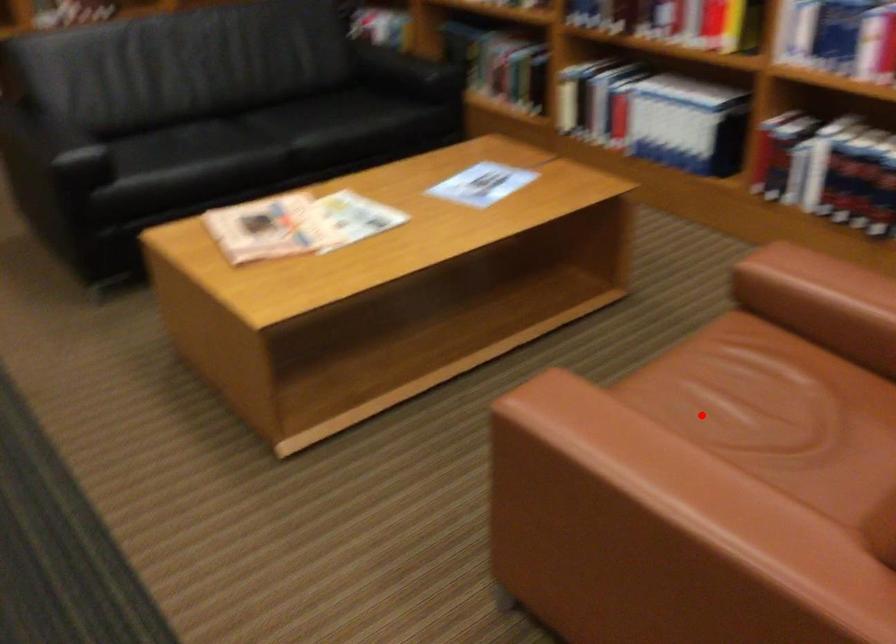
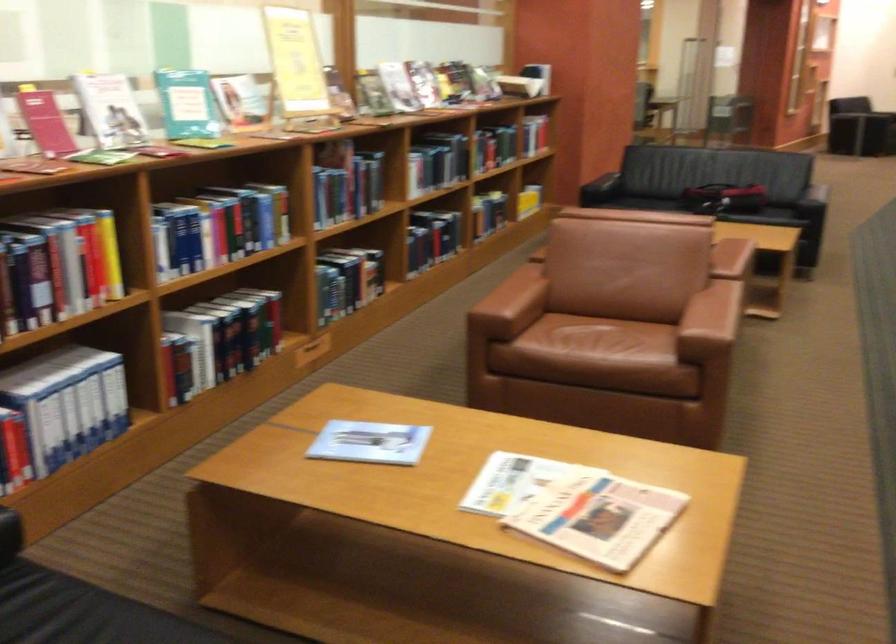
Question: I am providing you with two images of the same scene from different viewpoints. Image1 has a red point marked. In image2, the corresponding 3D location appears at what relative position? Reply with the corresponding letter.

Choices:
 (A) Closer
 (B) Farther

Answer: (B)